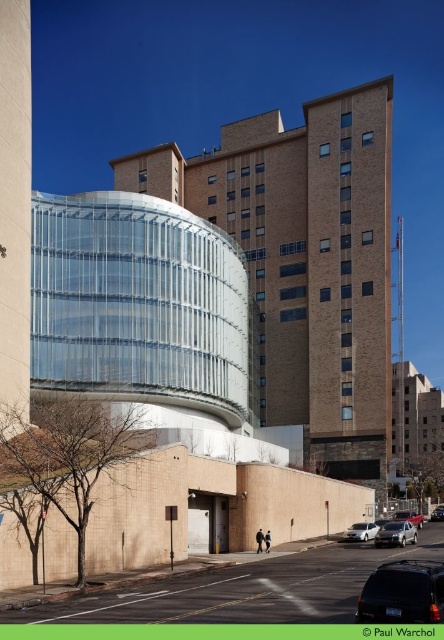
You are a delivery driver who needs to park your silver metallic sedan at center in a parking spot located at coordinates point 0.809, 0.923. Can you confirm if your vehicle is already positioned correctly?

The silver metallic sedan at center is already positioned at point [409,516], so it is correctly parked in the designated parking spot.

You are a delivery driver needing to park your silver metallic sedan at lower right. There is another metallic silver sedan at center blocking the parking spot. Can you maneuver around it to park?

The silver metallic sedan at lower right is to the left of metallic silver sedan at center, so you can maneuver around it by moving to the right side of the metallic silver sedan at center to park.